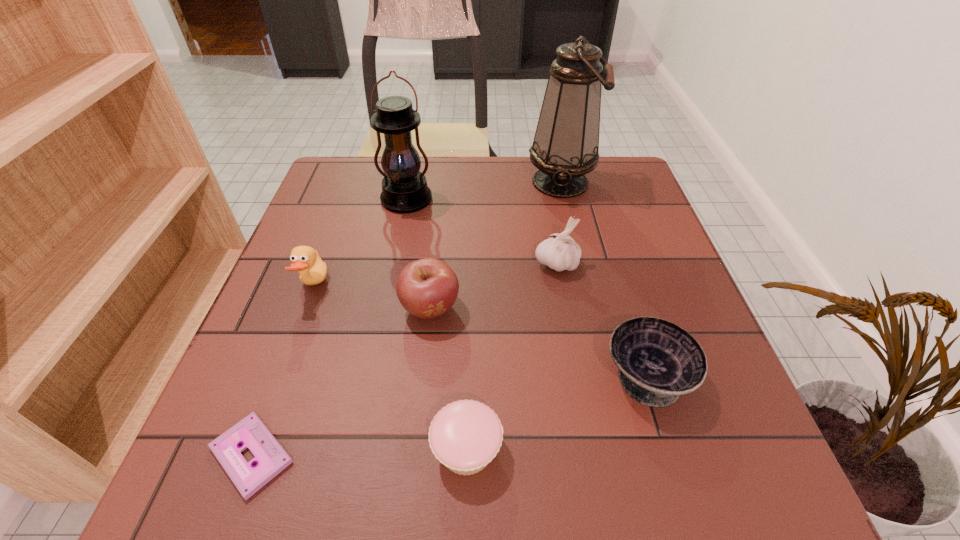
Locate an element on the screen. free space located on the front of the garlic is located at coordinates click(581, 402).

At what (x,y) coordinates should I click in order to perform the action: click on vacant space situated 0.110m on the beak of the duck. Please return your answer as a coordinate pair (x, y). The height and width of the screenshot is (540, 960). Looking at the image, I should click on (379, 286).

I want to click on vacant space located 0.210m on the side of the apple with the unique marking, so click(417, 436).

Image resolution: width=960 pixels, height=540 pixels. In order to click on free region located on the left of the bowl in this screenshot , I will do `click(534, 376)`.

This screenshot has width=960, height=540. I want to click on vacant space situated on the back of the cupcake, so click(468, 369).

At what (x,y) coordinates should I click in order to perform the action: click on free space located on the back of the videotape. Please return your answer as a coordinate pair (x, y). The height and width of the screenshot is (540, 960). Looking at the image, I should click on (300, 324).

Find the location of a particular element. This screenshot has height=540, width=960. oil lamp at the far edge is located at coordinates (566, 143).

Identify the location of lantern present at the far edge. (404, 188).

Identify the location of cupcake positioned at the near edge. The width and height of the screenshot is (960, 540). (465, 435).

What are the coordinates of `videotape that is positioned at the near edge` in the screenshot? It's located at (270, 458).